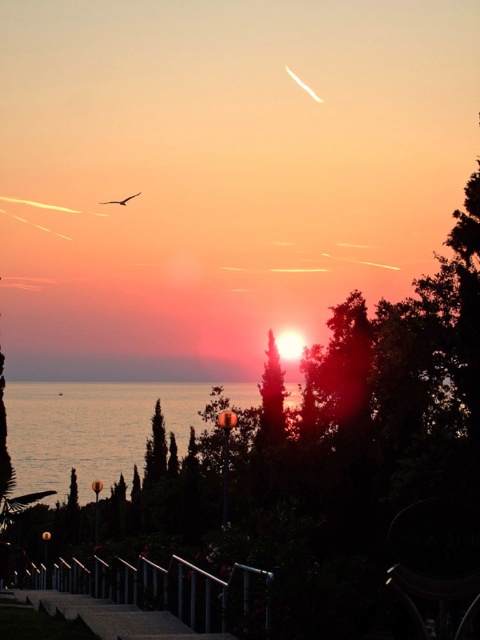
You are standing on the top of the stairs and looking towards the sea. You see the green matte tree at center and the matte black bird at upper center. Which object is closer to the horizon?

The matte black bird at upper center is closer to the horizon because it is positioned higher in the sky than the green matte tree at center, which is shorter and located lower in the frame.

You are standing at the top of the stairs and want to walk to the green matte tree at center. Which direction should you move relative to the transparent glass water at lower left?

You should move to the right of the transparent glass water at lower left to reach the green matte tree at center because the transparent glass water at lower left is positioned to the left of the green matte tree at center.